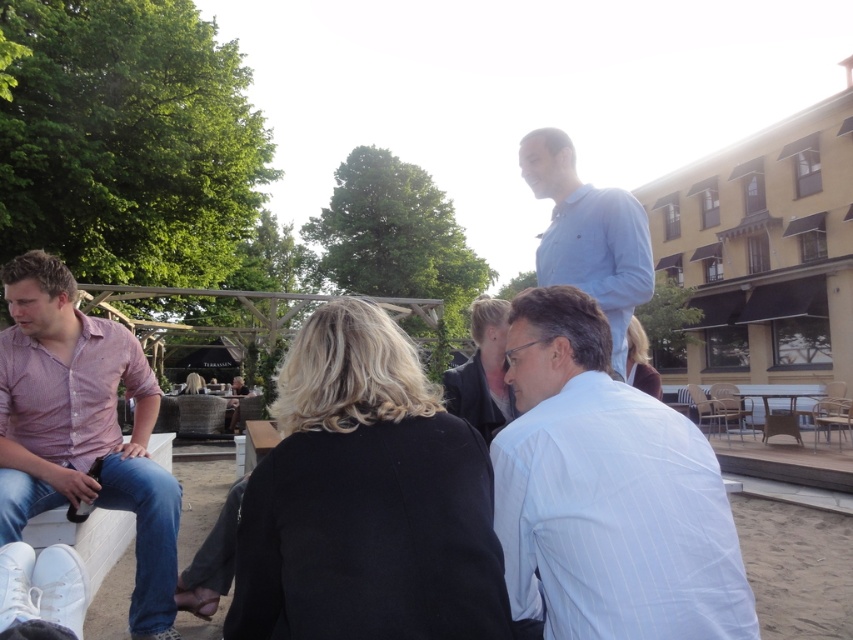
You are a photographer trying to capture a group photo of the people on the low wall. Since the pink striped shirt at left and the black leather jacket at center are partially blocking the view, which one should you move closer to the camera to ensure both are fully visible?

The pink striped shirt at left is larger in size than the black leather jacket at center, so moving the pink striped shirt at left closer to the camera would help ensure both are fully visible.

You are a photographer trying to capture a candid shot of the light blue shirt at upper center without including the rattan picnic table at lower right in the frame. Based on their positions, can you position yourself in a way to achieve this?

The light blue shirt at upper center is above the rattan picnic table at lower right, so by positioning yourself lower and angling the camera upward, you can focus on the light blue shirt at upper center while avoiding the rattan picnic table at lower right in the shot.